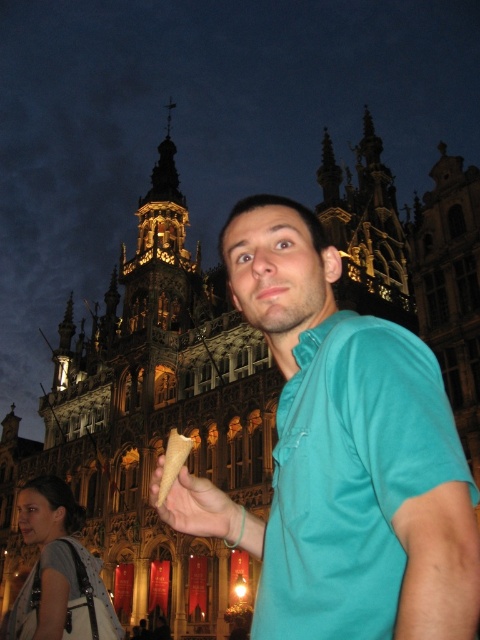
Which is in front, point (191, 524) or point (164, 468)?

Point (191, 524) is in front.

Which is below, smooth beige cone at center or golden waffle cone at center?

smooth beige cone at center is lower down.

Does point (218, 508) come behind point (178, 472)?

Yes, it is.

At what (x,y) coordinates should I click in order to perform the action: click on smooth beige cone at center. Please return your answer as a coordinate pair (x, y). The width and height of the screenshot is (480, 640). Looking at the image, I should click on (201, 508).

Who is lower down, teal fabric shirt at center or smooth beige cone at center?

smooth beige cone at center is below.

Between point (316, 444) and point (181, 528), which one is positioned behind?

The point (181, 528) is behind.

Is point (288, 592) positioned after point (223, 516)?

No, (288, 592) is closer to viewer.

I want to click on teal fabric shirt at center, so click(x=349, y=452).

Does teal fabric shirt at center have a greater width compared to golden waffle cone at center?

Yes, teal fabric shirt at center is wider than golden waffle cone at center.

The height and width of the screenshot is (640, 480). I want to click on teal fabric shirt at center, so click(349, 452).